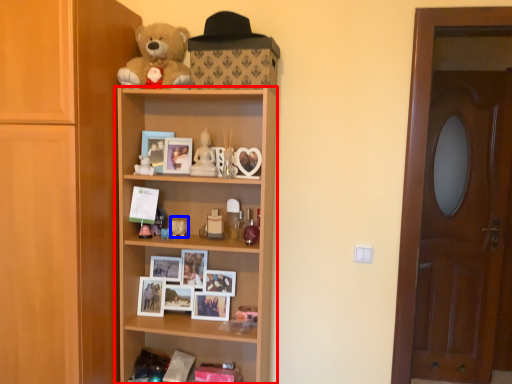
Question: Which object appears farthest to the camera in this image, shelf (highlighted by a red box) or toy (highlighted by a blue box)?

Choices:
 (A) shelf
 (B) toy

Answer: (B)